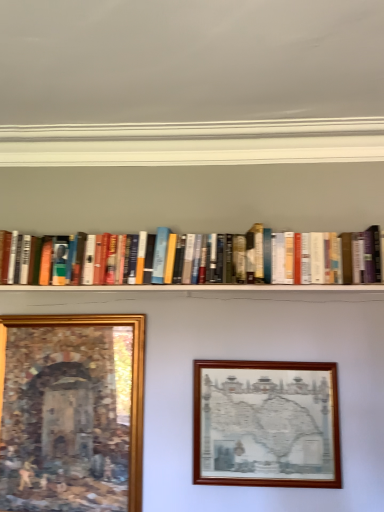
Question: Which direction should I rotate to look at wooden picture frame at center, the 2th picture frame positioned from the left, — up or down?

Choices:
 (A) up
 (B) down

Answer: (B)

Question: Does hardcover books at center have a lesser width compared to gold-framed painting at lower left, the 1th picture frame viewed from the left?

Choices:
 (A) no
 (B) yes

Answer: (A)

Question: From a real-world perspective, is hardcover books at center positioned over gold-framed painting at lower left, the 1th picture frame viewed from the left, based on gravity?

Choices:
 (A) yes
 (B) no

Answer: (A)

Question: Can you confirm if hardcover books at center is smaller than gold-framed painting at lower left, the 1th picture frame viewed from the left?

Choices:
 (A) no
 (B) yes

Answer: (A)

Question: Is hardcover books at center turned away from gold-framed painting at lower left, the 1th picture frame viewed from the left?

Choices:
 (A) no
 (B) yes

Answer: (A)

Question: Considering the relative sizes of hardcover books at center and gold-framed painting at lower left, which is the second picture frame in right-to-left order, in the image provided, is hardcover books at center wider than gold-framed painting at lower left, which is the second picture frame in right-to-left order,?

Choices:
 (A) yes
 (B) no

Answer: (A)

Question: Is hardcover books at center next to gold-framed painting at lower left, the 1th picture frame viewed from the left?

Choices:
 (A) yes
 (B) no

Answer: (B)

Question: Does wooden picture frame at center, the first picture frame from the right, have a smaller size compared to hardcover books at center?

Choices:
 (A) yes
 (B) no

Answer: (A)

Question: Can hardcover books at center be found inside wooden picture frame at center, the 2th picture frame positioned from the left?

Choices:
 (A) yes
 (B) no

Answer: (B)

Question: Are wooden picture frame at center, the 2th picture frame positioned from the left, and hardcover books at center beside each other?

Choices:
 (A) yes
 (B) no

Answer: (B)

Question: Considering the relative positions of wooden picture frame at center, the first picture frame from the right, and hardcover books at center in the image provided, is wooden picture frame at center, the first picture frame from the right, behind hardcover books at center?

Choices:
 (A) no
 (B) yes

Answer: (A)

Question: Considering the relative positions of wooden picture frame at center, the first picture frame from the right, and hardcover books at center in the image provided, is wooden picture frame at center, the first picture frame from the right, to the right of hardcover books at center from the viewer's perspective?

Choices:
 (A) no
 (B) yes

Answer: (B)

Question: Is wooden picture frame at center, the first picture frame from the right, oriented away from hardcover books at center?

Choices:
 (A) yes
 (B) no

Answer: (B)

Question: Is hardcover books at center bigger than wooden picture frame at center, the first picture frame from the right?

Choices:
 (A) no
 (B) yes

Answer: (B)